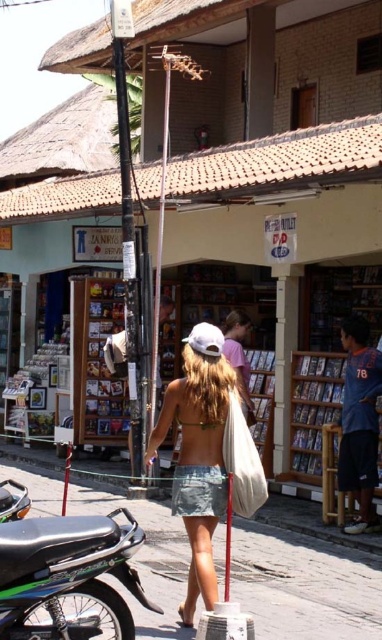
You are standing at the point marked by the coordinates point [67,573] in the scene. What object are you standing on?

You are standing on the green matte motorcycle at lower left.

You are a delivery person who needs to choose a motorcycle to deliver packages in this tropical area. Both the green matte motorcycle at lower left and the shiny black motorcycle at lower left are available. Which motorcycle has a bigger size and would be more suitable for carrying heavy loads?

The green matte motorcycle at lower left has a larger size compared to the shiny black motorcycle at lower left, so it would be more suitable for carrying heavy loads.

You are a tourist in this tropical area and want to take a photo of the pink fabric shirt at center and the shiny black motorcycle at lower left. Which object should you focus on first if you want to capture both in the same frame without moving the camera?

The pink fabric shirt at center is located above the shiny black motorcycle at lower left, so you should focus on the pink fabric shirt at center first to ensure both are in the frame.